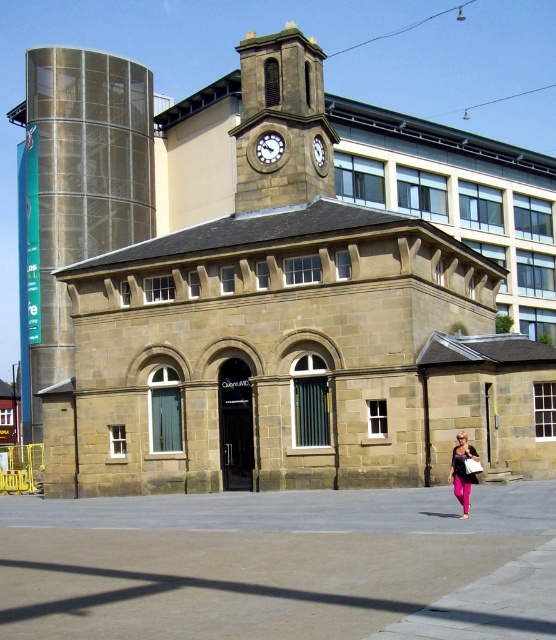
Question: Is the position of brass textured clock at center more distant than that of white stone clock at upper center?

Choices:
 (A) no
 (B) yes

Answer: (A)

Question: Does pink fabric pants at lower right appear on the left side of brass textured clock at center?

Choices:
 (A) no
 (B) yes

Answer: (A)

Question: Observing the image, what is the correct spatial positioning of pink fabric pants at lower right in reference to white stone clock at upper center?

Choices:
 (A) above
 (B) below

Answer: (B)

Question: Based on their relative distances, which object is nearer to the white stone clock at upper center?

Choices:
 (A) pink fabric pants at lower right
 (B) brass textured clock at center

Answer: (B)

Question: Which is nearer to the pink fabric pants at lower right?

Choices:
 (A) brass textured clock at center
 (B) white stone clock at upper center

Answer: (A)

Question: Which point is farther to the camera?

Choices:
 (A) (315, 164)
 (B) (264, 150)
 (C) (474, 454)

Answer: (B)